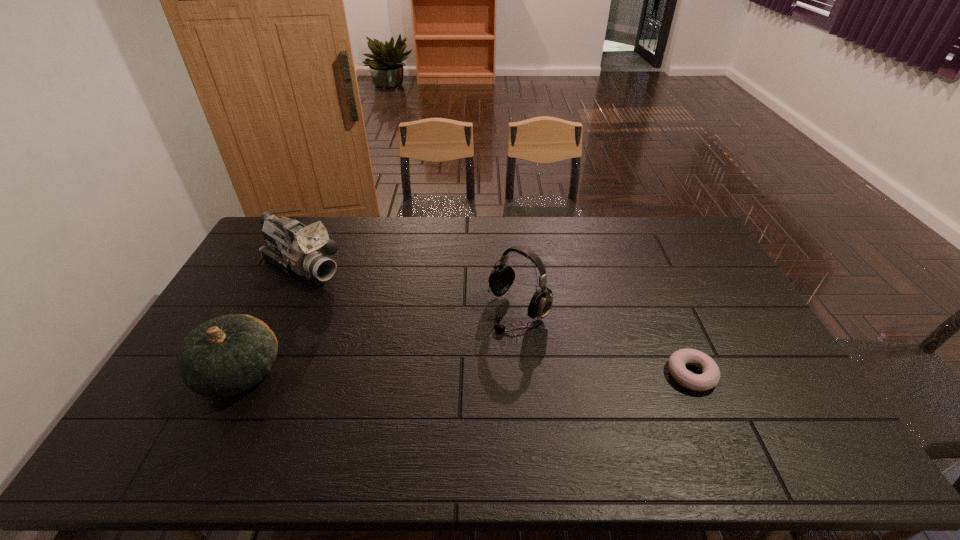
In the image, there is a desktop. At what (x,y) coordinates should I click in order to perform the action: click on vacant space at the far edge. Please return your answer as a coordinate pair (x, y). This screenshot has height=540, width=960. Looking at the image, I should click on (337, 244).

Where is `free space at the near edge of the desktop`? The height and width of the screenshot is (540, 960). free space at the near edge of the desktop is located at coordinates (537, 401).

This screenshot has height=540, width=960. Identify the location of vacant space at the left edge. (279, 273).

Locate an element on the screen. Image resolution: width=960 pixels, height=540 pixels. vacant space at the right edge of the desktop is located at coordinates (701, 312).

Identify the location of free space at the near left corner of the desktop. (180, 392).

In order to click on vacant area at the far right corner in this screenshot , I will do `click(692, 248)`.

You are a GUI agent. You are given a task and a screenshot of the screen. Output one action in this format:
    pyautogui.click(x=<x>, y=<y>)
    Task: Click on the free space between the camcorder and the headset
    Image resolution: width=960 pixels, height=540 pixels.
    Given the screenshot: What is the action you would take?
    pyautogui.click(x=410, y=288)

Image resolution: width=960 pixels, height=540 pixels. Find the location of `vacant space that's between the camcorder and the shortest object`. vacant space that's between the camcorder and the shortest object is located at coordinates (496, 321).

Locate an element on the screen. free point between the camcorder and the doughnut is located at coordinates (496, 321).

This screenshot has height=540, width=960. In order to click on empty location between the camcorder and the doughnut in this screenshot , I will do `click(496, 321)`.